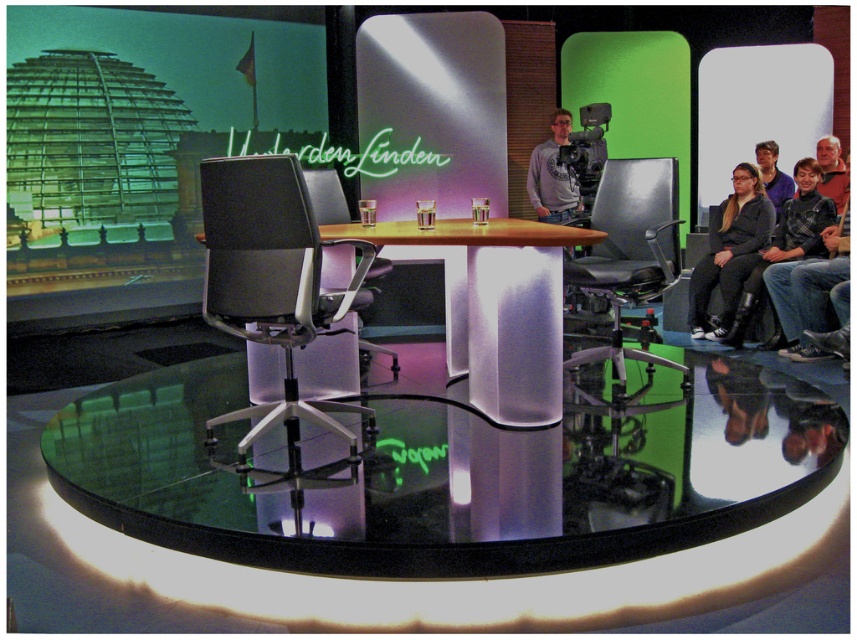
Is transparent glass table at center to the left of transparent glass round table at center from the viewer's perspective?

Indeed, transparent glass table at center is positioned on the left side of transparent glass round table at center.

Identify the location of transparent glass table at center. The height and width of the screenshot is (640, 857). (447, 474).

Locate an element on the screen. The height and width of the screenshot is (640, 857). transparent glass table at center is located at coordinates coord(447,474).

You are a GUI agent. You are given a task and a screenshot of the screen. Output one action in this format:
    pyautogui.click(x=<x>, y=<y>)
    Task: Click on the transparent glass table at center
    The width and height of the screenshot is (857, 640).
    Given the screenshot: What is the action you would take?
    [x=447, y=474]

Between point (676, 544) and point (316, 186), which one is positioned in front?

Point (676, 544)

Is point (96, 419) farther from camera compared to point (324, 204)?

No, (96, 419) is closer to viewer.

The image size is (857, 640). Identify the location of transparent glass table at center. [447, 474].

Is point (471, 355) closer to camera compared to point (664, 360)?

Yes.

Does transparent glass round table at center lie behind matte black chair at center?

No, it is not.

Who is more distant from viewer, (496, 340) or (638, 234)?

Positioned behind is point (638, 234).

Image resolution: width=857 pixels, height=640 pixels. I want to click on transparent glass round table at center, so click(500, 307).